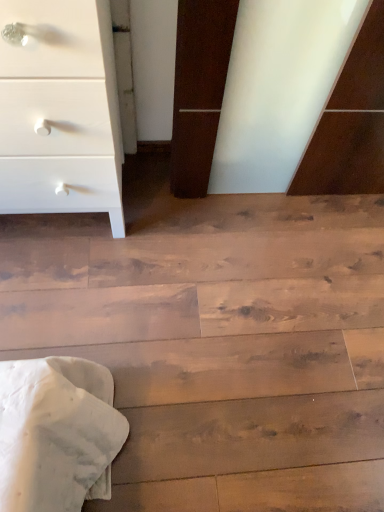
Question: Should I look upward or downward to see wooden floor at lower center?

Choices:
 (A) down
 (B) up

Answer: (A)

Question: Does wooden floor at lower center appear on the left side of white matte chest of drawers at upper left?

Choices:
 (A) no
 (B) yes

Answer: (A)

Question: Is wooden floor at lower center thinner than white matte chest of drawers at upper left?

Choices:
 (A) yes
 (B) no

Answer: (B)

Question: Is wooden floor at lower center facing away from white matte chest of drawers at upper left?

Choices:
 (A) no
 (B) yes

Answer: (A)

Question: Is wooden floor at lower center far from white matte chest of drawers at upper left?

Choices:
 (A) no
 (B) yes

Answer: (A)

Question: Is wooden floor at lower center positioned behind white matte chest of drawers at upper left?

Choices:
 (A) no
 (B) yes

Answer: (B)

Question: From a real-world perspective, does wooden floor at lower center sit lower than white matte chest of drawers at upper left?

Choices:
 (A) no
 (B) yes

Answer: (B)

Question: Is white matte chest of drawers at upper left at the right side of wooden floor at lower center?

Choices:
 (A) no
 (B) yes

Answer: (A)

Question: Is white matte chest of drawers at upper left positioned before wooden floor at lower center?

Choices:
 (A) no
 (B) yes

Answer: (B)

Question: Can you confirm if white matte chest of drawers at upper left is positioned to the left of wooden floor at lower center?

Choices:
 (A) no
 (B) yes

Answer: (B)

Question: Is white matte chest of drawers at upper left oriented towards wooden floor at lower center?

Choices:
 (A) no
 (B) yes

Answer: (A)

Question: From the image's perspective, is white matte chest of drawers at upper left beneath wooden floor at lower center?

Choices:
 (A) no
 (B) yes

Answer: (A)

Question: Can you confirm if white matte chest of drawers at upper left is smaller than wooden floor at lower center?

Choices:
 (A) yes
 (B) no

Answer: (B)

Question: Is wooden floor at lower center in front of or behind white matte chest of drawers at upper left in the image?

Choices:
 (A) front
 (B) behind

Answer: (B)